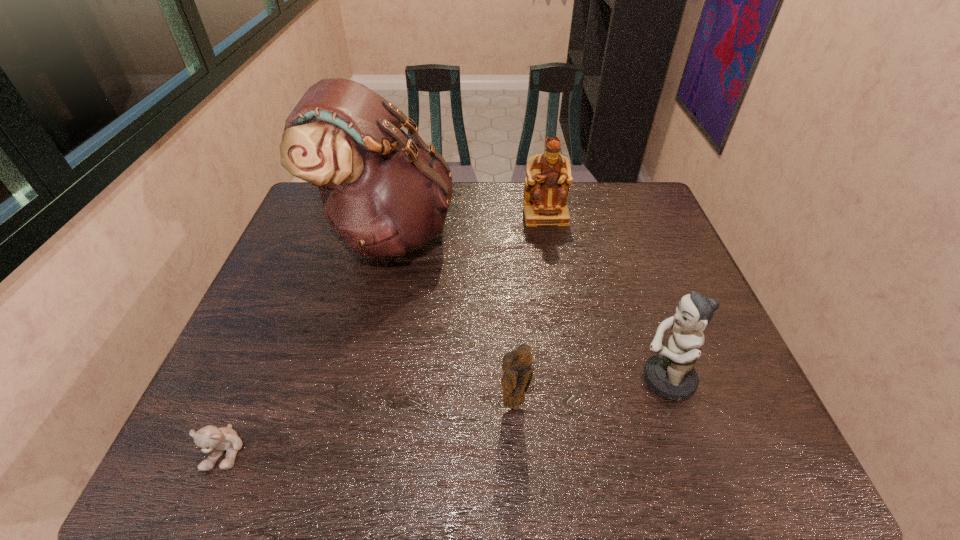
In order to click on vacant area that lies between the tallest object and the second object from right to left in this screenshot , I will do `click(468, 224)`.

The height and width of the screenshot is (540, 960). I want to click on free space that is in between the third object from left to right and the shortest object, so click(370, 428).

Locate an element on the screen. This screenshot has height=540, width=960. vacant area between the rightmost object and the nearest object is located at coordinates (445, 415).

You are a GUI agent. You are given a task and a screenshot of the screen. Output one action in this format:
    pyautogui.click(x=<x>, y=<y>)
    Task: Click on the vacant space in between the teddy bear and the third object from left to right
    This screenshot has height=540, width=960.
    Given the screenshot: What is the action you would take?
    pyautogui.click(x=370, y=428)

You are a GUI agent. You are given a task and a screenshot of the screen. Output one action in this format:
    pyautogui.click(x=<x>, y=<y>)
    Task: Click on the free space that is in between the tallest object and the nearest object
    The height and width of the screenshot is (540, 960).
    Given the screenshot: What is the action you would take?
    pyautogui.click(x=307, y=342)

This screenshot has height=540, width=960. Identify the location of vacant space that's between the leftmost figurine and the fourth object from left to right. (530, 310).

In order to click on free space between the teddy bear and the satchel in this screenshot , I will do `click(307, 342)`.

Locate an element on the screen. Image resolution: width=960 pixels, height=540 pixels. free space that is in between the tallest object and the rightmost figurine is located at coordinates (527, 306).

Locate an element on the screen. empty space that is in between the shortest object and the farthest figurine is located at coordinates (385, 333).

Identify which object is the closest to the farthest figurine. Please provide its 2D coordinates. Your answer should be formatted as a tuple, i.e. [(x, y)], where the tuple contains the x and y coordinates of a point satisfying the conditions above.

[(384, 193)]